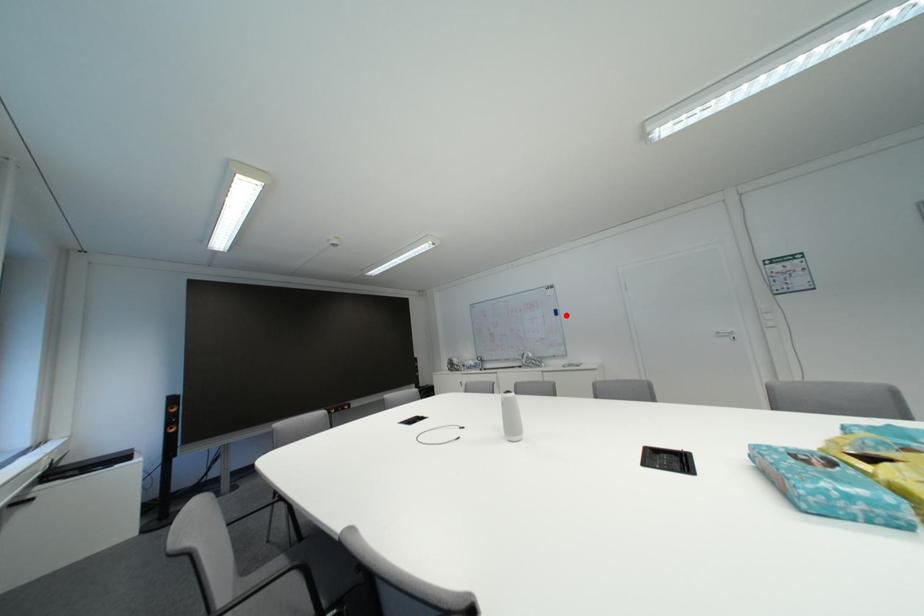
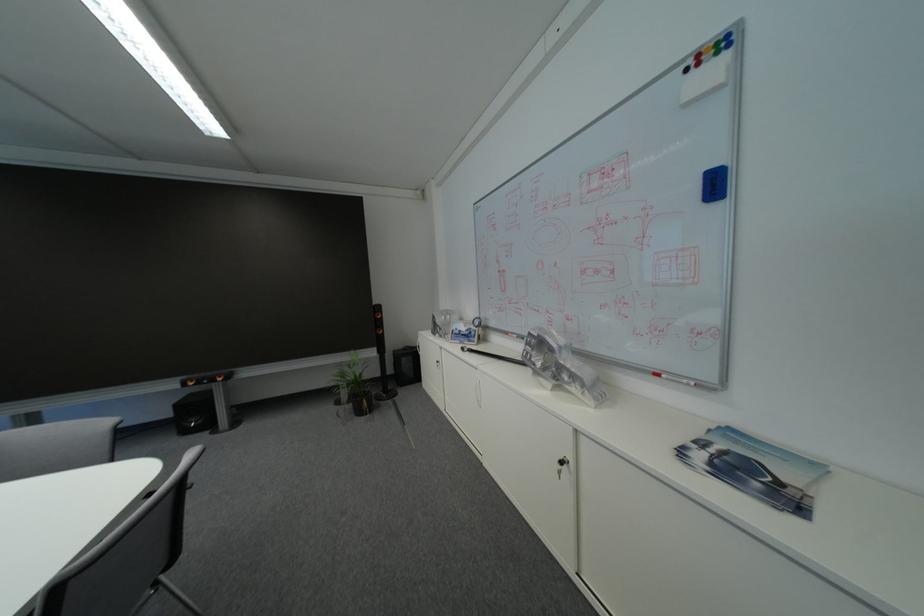
Where in the second image is the point corresponding to the highlighted location from the first image?

(726, 188)